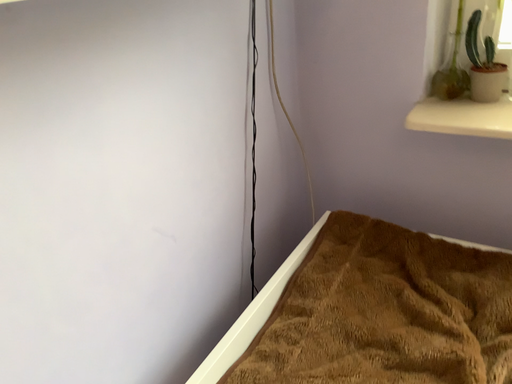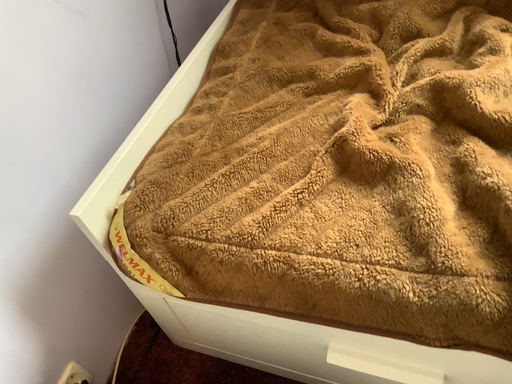
Question: How did the camera likely rotate when shooting the video?

Choices:
 (A) rotated right
 (B) rotated left

Answer: (A)